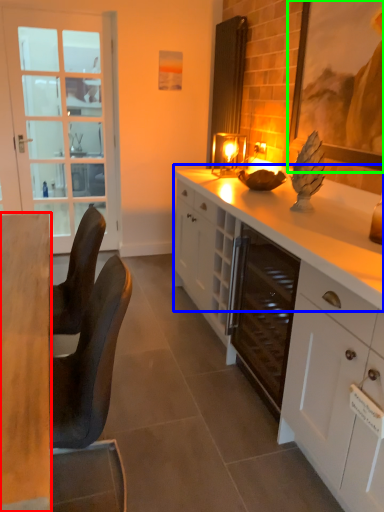
Question: Which is nearer to the desk (highlighted by a red box)? countertop (highlighted by a blue box) or picture frame (highlighted by a green box).

Choices:
 (A) countertop
 (B) picture frame

Answer: (A)